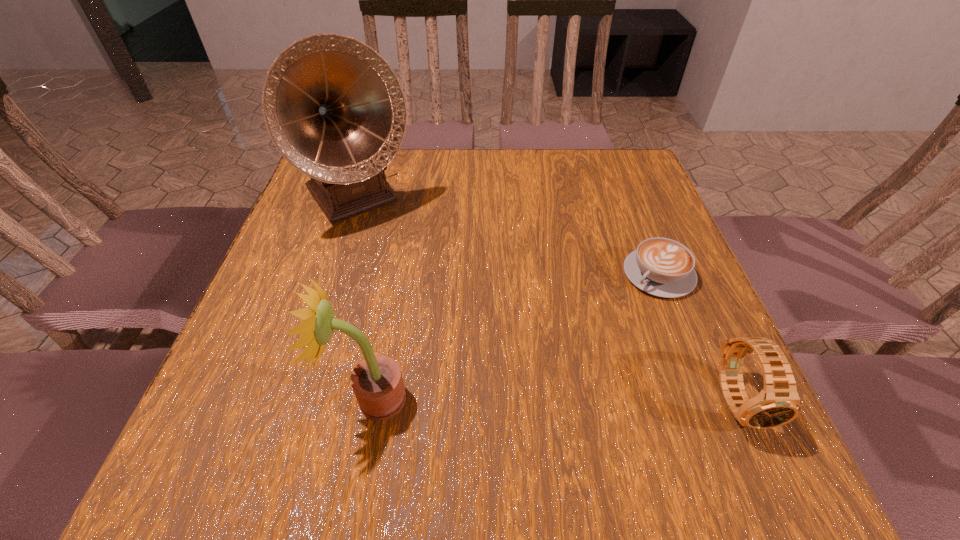
Where is `vacant area between the third nearest object and the third shortest object`? This screenshot has height=540, width=960. vacant area between the third nearest object and the third shortest object is located at coordinates (516, 336).

Find the location of a particular element. free spot between the shortest object and the sunflower is located at coordinates (516, 336).

Locate an element on the screen. This screenshot has height=540, width=960. blank region between the phonograph record and the sunflower is located at coordinates (366, 299).

Where is `vacant area between the third tallest object and the farthest object`? This screenshot has width=960, height=540. vacant area between the third tallest object and the farthest object is located at coordinates (548, 300).

In order to click on free space between the third shortest object and the phonograph record in this screenshot , I will do `click(366, 299)`.

This screenshot has width=960, height=540. I want to click on free space between the tallest object and the second tallest object, so click(366, 299).

What are the coordinates of `free space between the third shortest object and the cappuccino` in the screenshot? It's located at (516, 336).

Identify the location of blank region between the third tallest object and the tallest object. The image size is (960, 540). (548, 300).

At what (x,y) coordinates should I click in order to perform the action: click on the third closest object relative to the watch. Please return your answer as a coordinate pair (x, y). This screenshot has height=540, width=960. Looking at the image, I should click on (335, 110).

The image size is (960, 540). In order to click on the third closest object to the tallest object in this screenshot , I will do `click(778, 403)`.